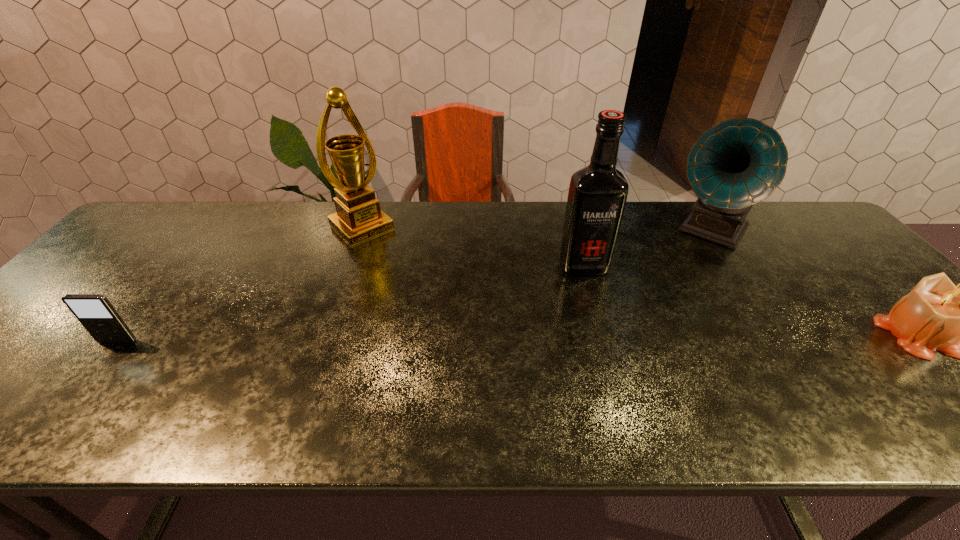
At what (x,y) coordinates should I click in order to perform the action: click on vacant space located on the front-facing side of the award. Please return your answer as a coordinate pair (x, y). The image size is (960, 540). Looking at the image, I should click on (423, 284).

Image resolution: width=960 pixels, height=540 pixels. Find the location of `vacant space located on the front-facing side of the award`. vacant space located on the front-facing side of the award is located at coordinates (460, 319).

Where is `free location located 0.240m on the front-facing side of the award`? This screenshot has height=540, width=960. free location located 0.240m on the front-facing side of the award is located at coordinates click(423, 284).

Find the location of `vacant space located on the front-facing side of the liquor`. vacant space located on the front-facing side of the liquor is located at coordinates (611, 337).

Locate an element on the screen. The width and height of the screenshot is (960, 540). vacant space situated on the front-facing side of the liquor is located at coordinates (622, 368).

Identify the location of free space located 0.250m on the front-facing side of the liquor. This screenshot has height=540, width=960. (615, 350).

Locate an element on the screen. Image resolution: width=960 pixels, height=540 pixels. phonograph_record that is at the far edge is located at coordinates (737, 163).

Locate an element on the screen. This screenshot has height=540, width=960. award that is at the far edge is located at coordinates (358, 218).

In the image, there is a desktop. Where is `vacant space at the far edge`? Image resolution: width=960 pixels, height=540 pixels. vacant space at the far edge is located at coordinates (315, 240).

Where is `vacant space at the near edge of the desktop`? The height and width of the screenshot is (540, 960). vacant space at the near edge of the desktop is located at coordinates (612, 364).